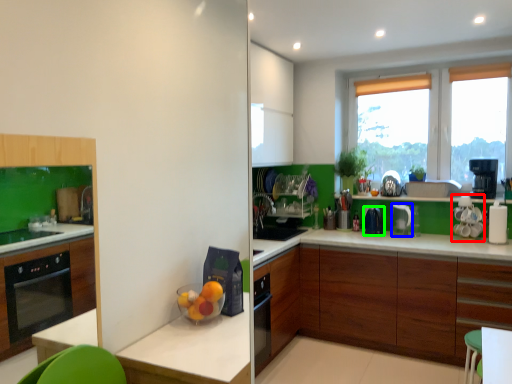
Question: Estimate the real-world distances between objects in this image. Which object is farther from appliance (highlighted by a red box), kitchen appliance (highlighted by a blue box) or kitchen appliance (highlighted by a green box)?

Choices:
 (A) kitchen appliance
 (B) kitchen appliance

Answer: (B)